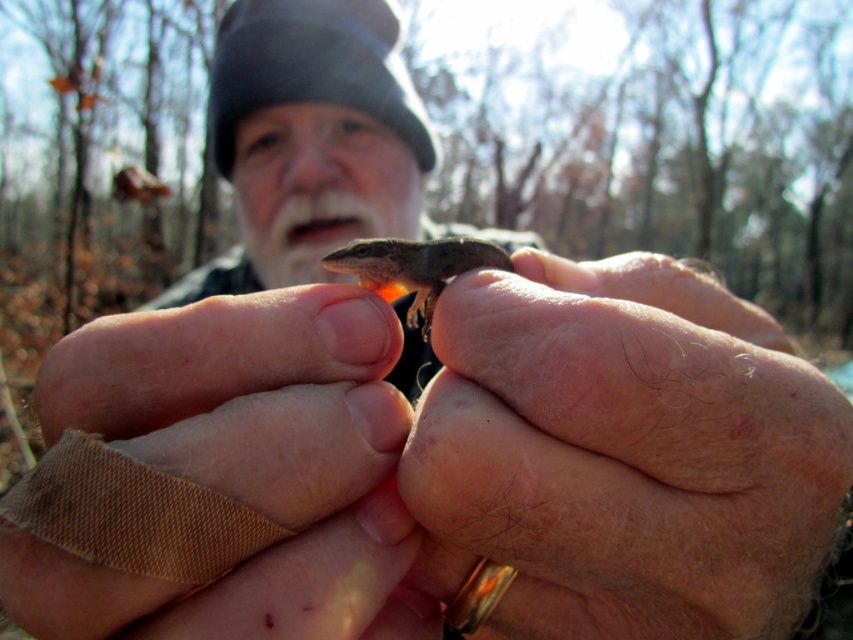
Question: Does leather-like brown glove at center appear on the left side of smooth brown lizard at center?

Choices:
 (A) no
 (B) yes

Answer: (B)

Question: Estimate the real-world distances between objects in this image. Which object is closer to the leather-like brown glove at center?

Choices:
 (A) smooth brown lizard at center
 (B) smooth skin hand at center

Answer: (A)

Question: Does leather-like brown glove at center have a lesser width compared to smooth brown lizard at center?

Choices:
 (A) no
 (B) yes

Answer: (A)

Question: Which object appears farthest from the camera in this image?

Choices:
 (A) smooth brown lizard at center
 (B) leather-like brown glove at center
 (C) smooth skin hand at center

Answer: (A)

Question: Does smooth skin hand at center appear under leather-like brown glove at center?

Choices:
 (A) yes
 (B) no

Answer: (B)

Question: Among these points, which one is nearest to the camera?

Choices:
 (A) (202, 400)
 (B) (650, 458)

Answer: (B)